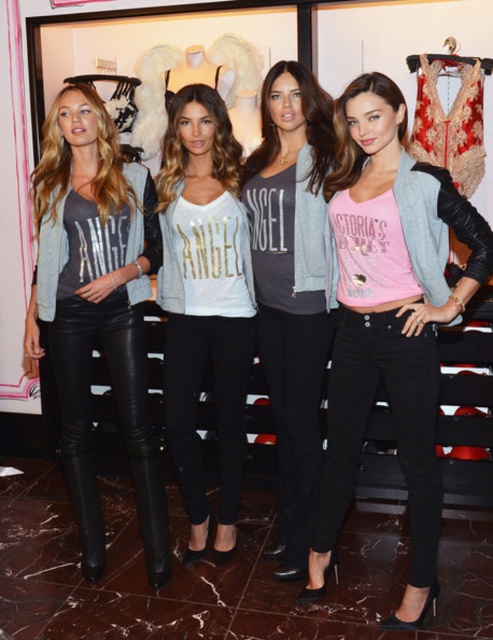
Can you confirm if pink matte crop top at center is positioned below matte black leather pants at left?

Yes, pink matte crop top at center is below matte black leather pants at left.

Is point (352, 477) positioned in front of point (152, 554)?

Yes, it is.

Find the location of a particular element. pink matte crop top at center is located at coordinates (x=389, y=317).

Between pink matte crop top at center and white matte jersey at center, which one is positioned higher?

white matte jersey at center is above.

Which of these two, pink matte crop top at center or white matte jersey at center, stands shorter?

pink matte crop top at center is shorter.

Which is behind, point (319, 577) or point (239, 376)?

The point (239, 376) is more distant.

The width and height of the screenshot is (493, 640). Identify the location of pink matte crop top at center. (389, 317).

Does pink matte crop top at center lie in front of matte gray jacket at center?

That is True.

Is pink matte crop top at center taller than matte gray jacket at center?

No, pink matte crop top at center is not taller than matte gray jacket at center.

Measure the distance between point (420,593) and camera.

The distance of point (420,593) from camera is 6.82 feet.

Where is `pink matte crop top at center`? pink matte crop top at center is located at coordinates coord(389,317).